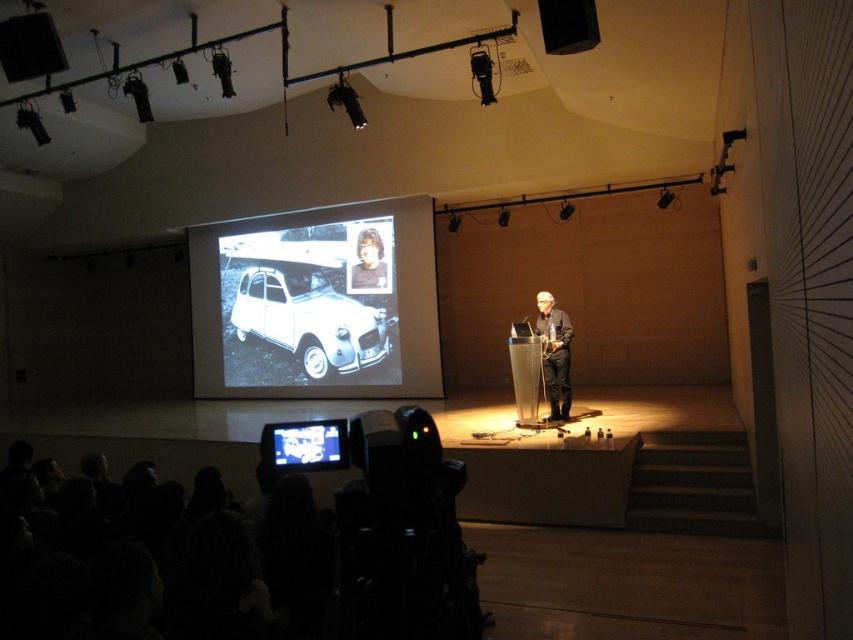
You are organizing a photo shoot and need to ensure that the white matte car at center and the black fabric person at center fit within the frame of your camera. Based on the scene description, which object should you position closer to the camera to ensure both fit without cropping?

The white matte car at center might be wider than the black fabric person at center, so positioning the car closer to the camera would help ensure both fit within the frame by adjusting their apparent sizes.

You are an event planner setting up a presentation. You have a black matte projection screen at center and a white matte car at center. Which object should you adjust the projector focus on first to ensure clarity, considering their sizes?

The black matte projection screen at center is bigger than the white matte car at center, so you should adjust the projector focus on the black matte projection screen at center first because larger objects often require more precise focus adjustments to ensure clarity.